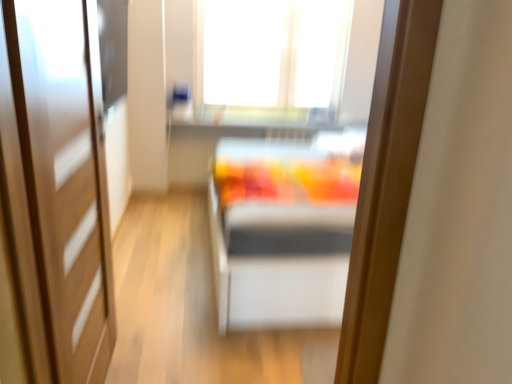
The width and height of the screenshot is (512, 384). I want to click on transparent glass window at upper center, so click(x=271, y=55).

What do you see at coordinates (271, 55) in the screenshot?
I see `transparent glass window at upper center` at bounding box center [271, 55].

What is the approximate height of transparent glass window at upper center?

The height of transparent glass window at upper center is 3.53 feet.

Measure the distance between point [248,85] and camera.

Point [248,85] is 13.31 feet from camera.

What do you see at coordinates (65, 176) in the screenshot? This screenshot has height=384, width=512. I see `wooden door at left` at bounding box center [65, 176].

You are a GUI agent. You are given a task and a screenshot of the screen. Output one action in this format:
    pyautogui.click(x=<x>, y=<y>)
    Task: Click on the wooden door at left
    
    Given the screenshot: What is the action you would take?
    coord(65,176)

Locate an element on the screen. transparent glass window at upper center is located at coordinates (271, 55).

Does wooden door at left appear on the left side of transparent glass window at upper center?

Indeed, wooden door at left is positioned on the left side of transparent glass window at upper center.

Considering their positions, is wooden door at left located in front of or behind transparent glass window at upper center?

Clearly, wooden door at left is in front of transparent glass window at upper center.

Does point (103, 256) come in front of point (220, 94)?

Yes, it is in front of point (220, 94).

From the image's perspective, does wooden door at left appear lower than transparent glass window at upper center?

Yes, from the image's perspective, wooden door at left is beneath transparent glass window at upper center.

From a real-world perspective, does wooden door at left stand above transparent glass window at upper center?

No, from a real-world perspective, wooden door at left is not over transparent glass window at upper center

Considering the sizes of objects wooden door at left and transparent glass window at upper center in the image provided, who is wider, wooden door at left or transparent glass window at upper center?

Wider between the two is transparent glass window at upper center.

Which of these two, wooden door at left or transparent glass window at upper center, stands shorter?

transparent glass window at upper center is shorter.

Considering the relative sizes of wooden door at left and transparent glass window at upper center in the image provided, is wooden door at left bigger than transparent glass window at upper center?

Actually, wooden door at left might be smaller than transparent glass window at upper center.

Consider the image. Is wooden door at left situated inside transparent glass window at upper center or outside?

wooden door at left is not enclosed by transparent glass window at upper center.

Are wooden door at left and transparent glass window at upper center making contact?

There is a gap between wooden door at left and transparent glass window at upper center.

Is transparent glass window at upper center at the back of wooden door at left?

No.

Measure the distance from wooden door at left to transparent glass window at upper center.

2.50 meters.

Where is `door directly beneath the transparent glass window at upper center (from a real-world perspective)`? door directly beneath the transparent glass window at upper center (from a real-world perspective) is located at coordinates 65,176.

Does transparent glass window at upper center appear on the left side of wooden door at left?

No, transparent glass window at upper center is not to the left of wooden door at left.

Which object is closer to the camera, transparent glass window at upper center or wooden door at left?

wooden door at left is in front.

Considering the positions of points (311, 121) and (74, 315), is point (311, 121) farther from camera compared to point (74, 315)?

Yes, point (311, 121) is farther from viewer.

From the image's perspective, which one is positioned higher, transparent glass window at upper center or wooden door at left?

transparent glass window at upper center appears higher in the image.

In the scene shown: From a real-world perspective, which object rests below the other?

wooden door at left.

Considering the sizes of objects transparent glass window at upper center and wooden door at left in the image provided, who is thinner, transparent glass window at upper center or wooden door at left?

wooden door at left is thinner.

From their relative heights in the image, would you say transparent glass window at upper center is taller or shorter than wooden door at left?

In the image, transparent glass window at upper center appears to be shorter than wooden door at left.

Does transparent glass window at upper center have a larger size compared to wooden door at left?

Yes.

Does transparent glass window at upper center contain wooden door at left?

Actually, wooden door at left is outside transparent glass window at upper center.

Is there a large distance between transparent glass window at upper center and wooden door at left?

Yes, transparent glass window at upper center is far from wooden door at left.

Is transparent glass window at upper center oriented away from wooden door at left?

No, transparent glass window at upper center is not facing away from wooden door at left.

How many degrees apart are the facing directions of transparent glass window at upper center and wooden door at left?

The angular difference between transparent glass window at upper center and wooden door at left is 90.7 degrees.

What are the coordinates of `window above the wooden door at left (from a real-world perspective)` in the screenshot? It's located at (271, 55).

At what (x,y) coordinates should I click in order to perform the action: click on window above the wooden door at left (from a real-world perspective). Please return your answer as a coordinate pair (x, y). The height and width of the screenshot is (384, 512). Looking at the image, I should click on (271, 55).

I want to click on window behind the wooden door at left, so click(x=271, y=55).